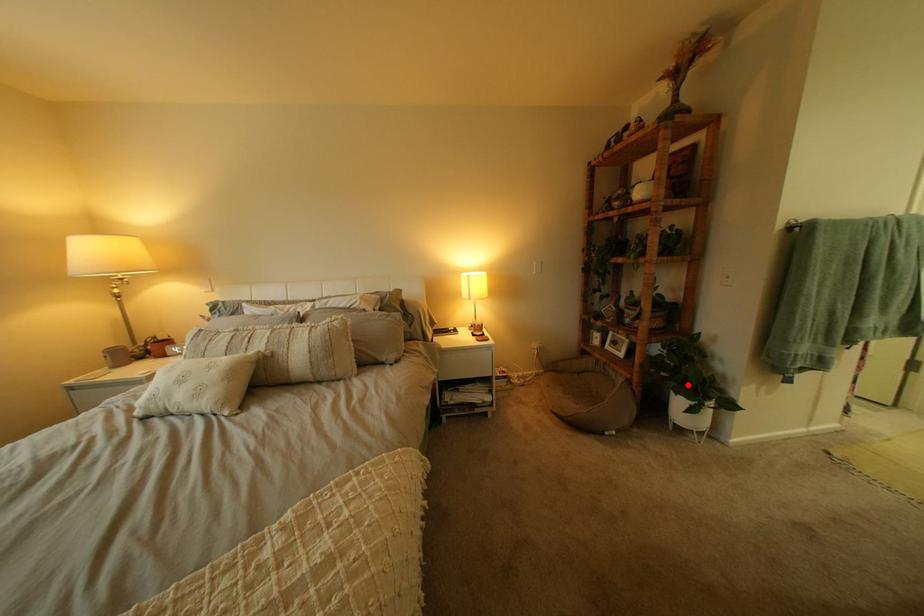
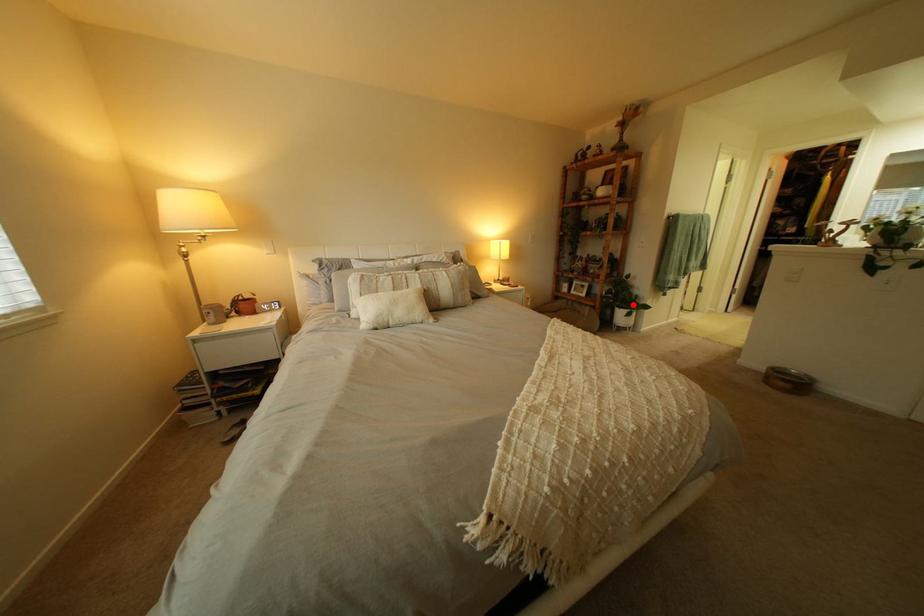
I am providing you with two images of the same scene from different viewpoints. A red point is marked on the first image and another point is marked on the second image. Do the highlighted points in image1 and image2 indicate the same real-world spot?

Yes